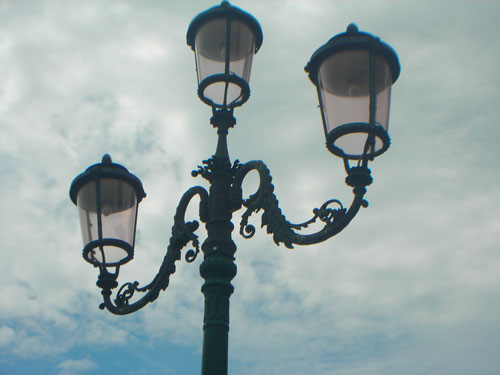
Where is `third glass light cover`? This screenshot has width=500, height=375. third glass light cover is located at coordinates (350, 99).